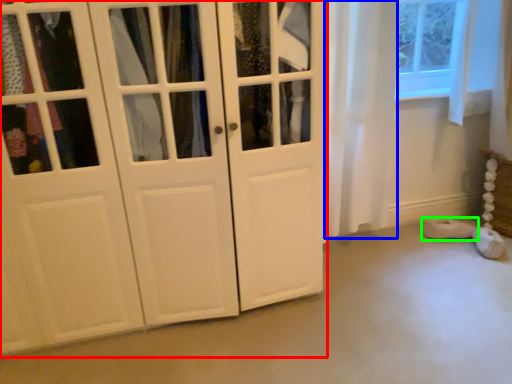
Question: Based on their relative distances, which object is nearer to cupboard (highlighted by a red box)? Choose from curtain (highlighted by a blue box) and footwear (highlighted by a green box).

Choices:
 (A) curtain
 (B) footwear

Answer: (A)